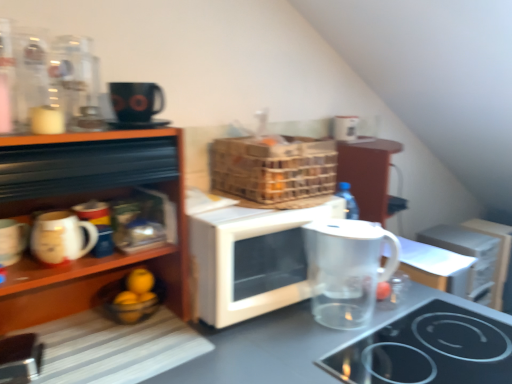
Locate an element on the screen. vacant space situated above transparent glass pitcher at center (from a real-world perspective) is located at coordinates (362, 329).